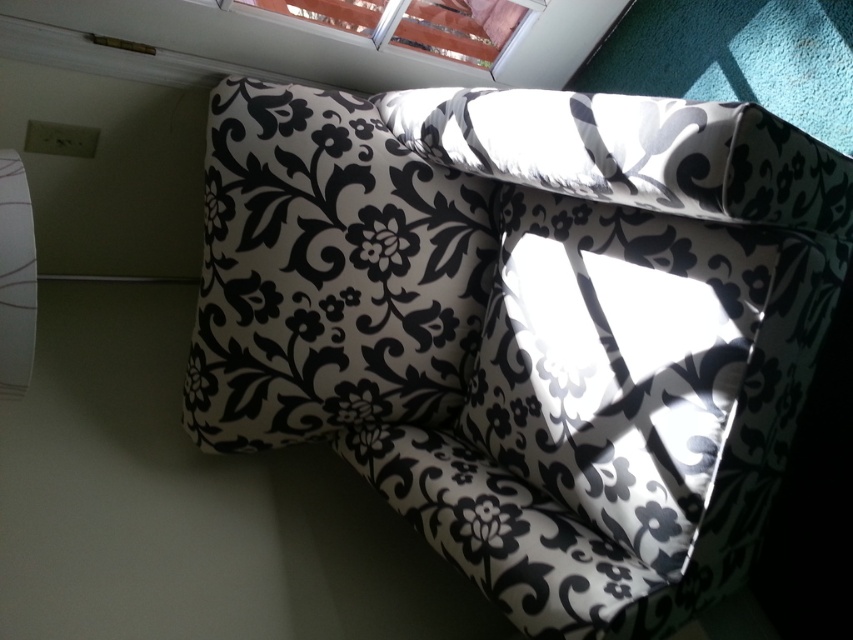
Question: Which point is farther to the camera?

Choices:
 (A) metallic silver blinds at upper center
 (B) black floral cushion at center
 (C) black floral fabric couch at center

Answer: (A)

Question: Which of the following is the farthest from the observer?

Choices:
 (A) (732, 280)
 (B) (496, 26)
 (C) (548, 576)

Answer: (B)

Question: Does black floral fabric couch at center appear under black floral cushion at center?

Choices:
 (A) no
 (B) yes

Answer: (A)

Question: Is black floral fabric couch at center positioned before black floral cushion at center?

Choices:
 (A) no
 (B) yes

Answer: (B)

Question: Which object is positioned closest to the black floral cushion at center?

Choices:
 (A) metallic silver blinds at upper center
 (B) black floral fabric couch at center

Answer: (B)

Question: Can you confirm if black floral cushion at center is positioned below metallic silver blinds at upper center?

Choices:
 (A) yes
 (B) no

Answer: (A)